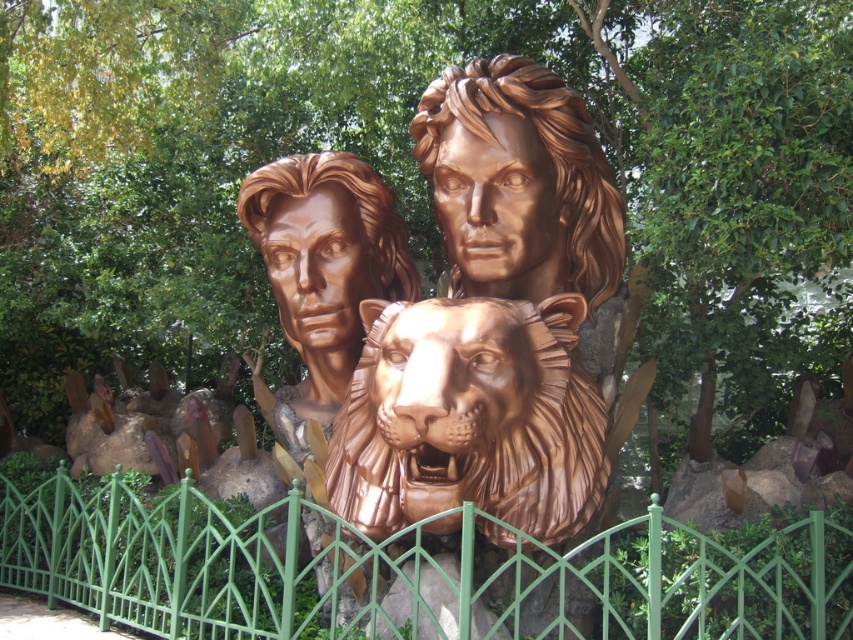
Question: Which point appears closest to the camera in this image?

Choices:
 (A) tap(550, 420)
 (B) tap(515, 61)
 (C) tap(505, 109)

Answer: (A)

Question: Does bronze metallic lion head at center come behind bronze lion head at upper center?

Choices:
 (A) yes
 (B) no

Answer: (B)

Question: Can you confirm if green leafy tree at upper center is positioned to the right of bronze metallic lion head at center?

Choices:
 (A) no
 (B) yes

Answer: (B)

Question: Which point is farther from the camera taking this photo?

Choices:
 (A) click(x=566, y=228)
 (B) click(x=601, y=156)
 (C) click(x=125, y=250)
 (D) click(x=515, y=397)

Answer: (C)

Question: Which of the following is the farthest from the observer?

Choices:
 (A) bronze metallic lion head at center
 (B) bronze statue at center
 (C) bronze lion head at upper center

Answer: (B)

Question: Is green leafy tree at upper center bigger than bronze metallic lion head at center?

Choices:
 (A) no
 (B) yes

Answer: (A)